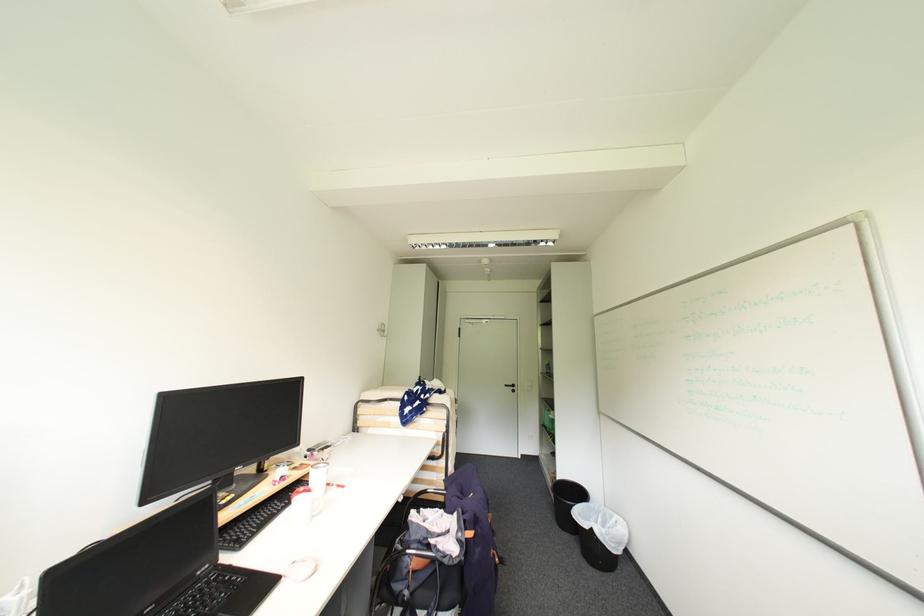
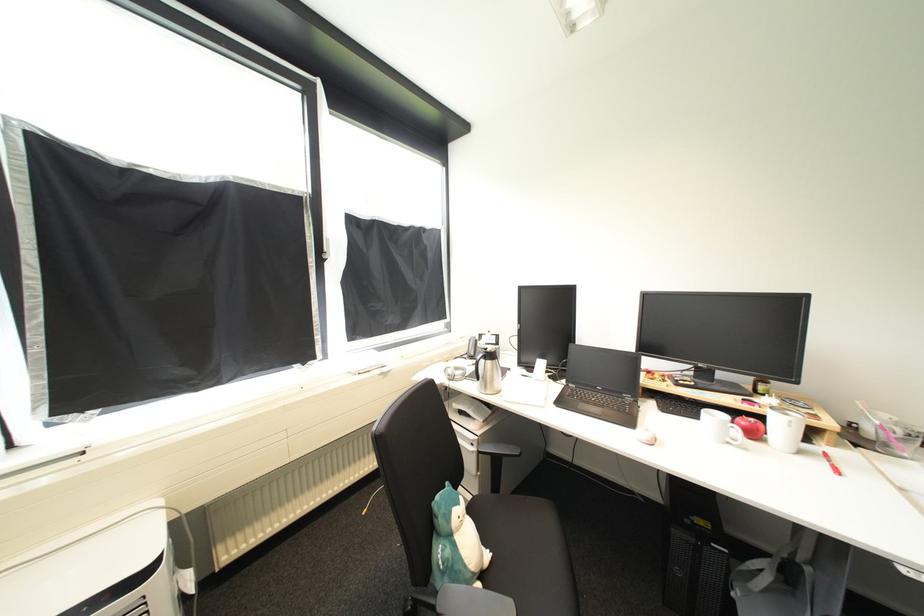
Locate, in the second image, the point that corresponds to (x=319, y=517) in the first image.

(736, 445)